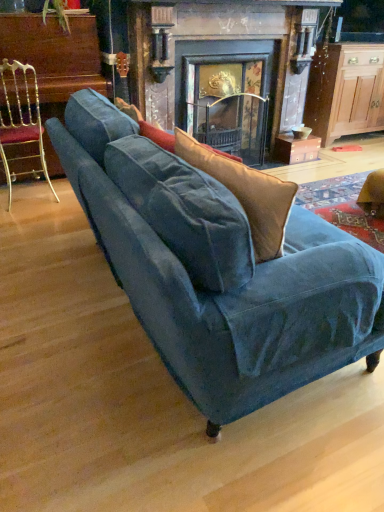
Question: Does gold metallic chair at left have a smaller size compared to dark gray stone fireplace at center?

Choices:
 (A) yes
 (B) no

Answer: (A)

Question: From the image's perspective, would you say gold metallic chair at left is positioned over dark gray stone fireplace at center?

Choices:
 (A) yes
 (B) no

Answer: (B)

Question: Could you tell me if gold metallic chair at left is facing dark gray stone fireplace at center?

Choices:
 (A) no
 (B) yes

Answer: (A)

Question: Considering the relative positions of gold metallic chair at left and dark gray stone fireplace at center in the image provided, is gold metallic chair at left to the left of dark gray stone fireplace at center from the viewer's perspective?

Choices:
 (A) yes
 (B) no

Answer: (A)

Question: Does gold metallic chair at left have a larger size compared to dark gray stone fireplace at center?

Choices:
 (A) no
 (B) yes

Answer: (A)

Question: Is gold metallic chair at left positioned far away from dark gray stone fireplace at center?

Choices:
 (A) yes
 (B) no

Answer: (A)

Question: Does gold metallic chair at left have a greater width compared to velvet blue couch at center?

Choices:
 (A) yes
 (B) no

Answer: (B)

Question: From the image's perspective, is gold metallic chair at left under velvet blue couch at center?

Choices:
 (A) yes
 (B) no

Answer: (B)

Question: Can velvet blue couch at center be found inside gold metallic chair at left?

Choices:
 (A) yes
 (B) no

Answer: (B)

Question: From the image's perspective, is gold metallic chair at left above velvet blue couch at center?

Choices:
 (A) no
 (B) yes

Answer: (B)

Question: Is the position of gold metallic chair at left more distant than that of velvet blue couch at center?

Choices:
 (A) no
 (B) yes

Answer: (B)

Question: Considering the relative sizes of gold metallic chair at left and velvet blue couch at center in the image provided, is gold metallic chair at left shorter than velvet blue couch at center?

Choices:
 (A) yes
 (B) no

Answer: (B)

Question: Is wooden cabinet at right aimed at gold metallic chair at left?

Choices:
 (A) yes
 (B) no

Answer: (B)